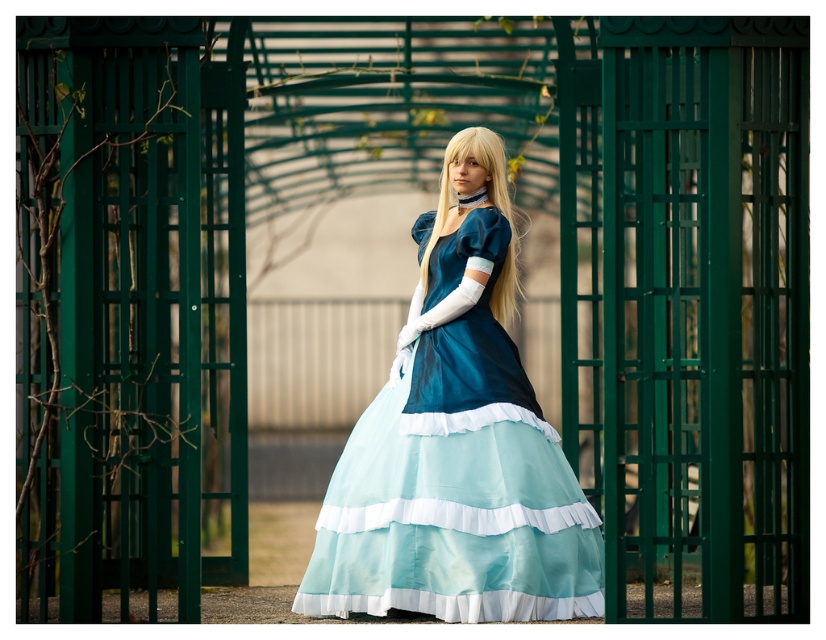
Does matte blue dress at center lie in front of blonde silky hair at center?

Yes, it is in front of blonde silky hair at center.

Looking at this image, does matte blue dress at center come behind blonde silky hair at center?

No, it is in front of blonde silky hair at center.

Is point (458, 132) closer to viewer compared to point (501, 276)?

No, (458, 132) is further to viewer.

Locate an element on the screen. The image size is (826, 640). matte blue dress at center is located at coordinates (457, 444).